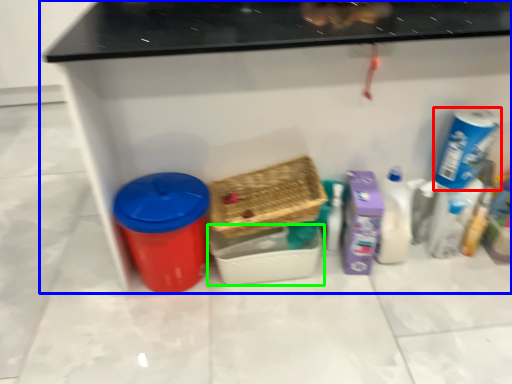
Question: Estimate the real-world distances between objects in this image. Which object is farther from cleaning product (highlighted by a red box), furniture (highlighted by a blue box) or basket (highlighted by a green box)?

Choices:
 (A) furniture
 (B) basket

Answer: (B)